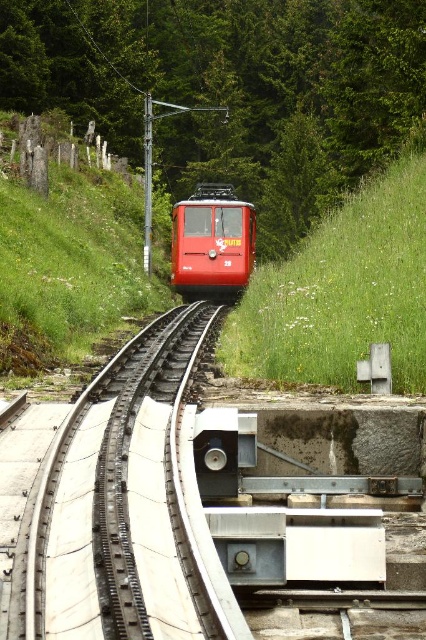
Between point (9, 490) and point (279, 285), which one is positioned in front?

Point (9, 490)

In the scene shown: Does metallic gray train track at center have a smaller size compared to green grass at center?

Yes.

This screenshot has height=640, width=426. What do you see at coordinates (118, 500) in the screenshot? I see `metallic gray train track at center` at bounding box center [118, 500].

You are a GUI agent. You are given a task and a screenshot of the screen. Output one action in this format:
    pyautogui.click(x=<x>, y=<y>)
    Task: Click on the metallic gray train track at center
    The image size is (426, 640).
    Given the screenshot: What is the action you would take?
    pyautogui.click(x=118, y=500)

Describe the element at coordinates (342, 291) in the screenshot. I see `green grass at center` at that location.

Based on the photo, between green grass at center and shiny red train at center, which one appears on the left side from the viewer's perspective?

Positioned to the left is shiny red train at center.

Who is more distant from viewer, (344, 266) or (244, 208)?

The point (244, 208) is more distant.

Where is `green grass at center`? green grass at center is located at coordinates (342, 291).

Does metallic gray train track at center have a greater height compared to shiny red train at center?

No.

Is metallic gray train track at center positioned behind shiny red train at center?

No, metallic gray train track at center is in front of shiny red train at center.

Between point (115, 588) and point (232, 225), which one is positioned behind?

The point (232, 225) is behind.

Locate an element on the screen. metallic gray train track at center is located at coordinates (118, 500).